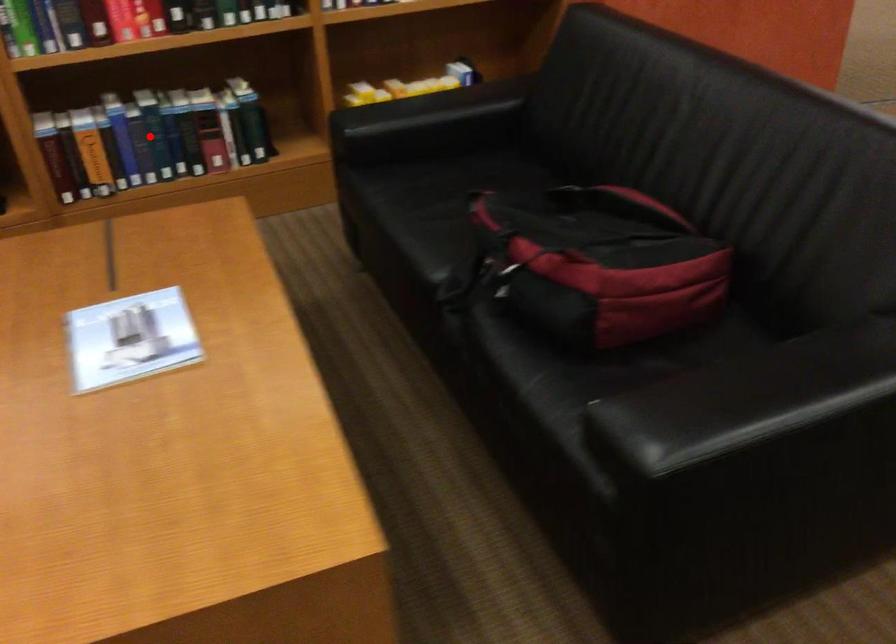
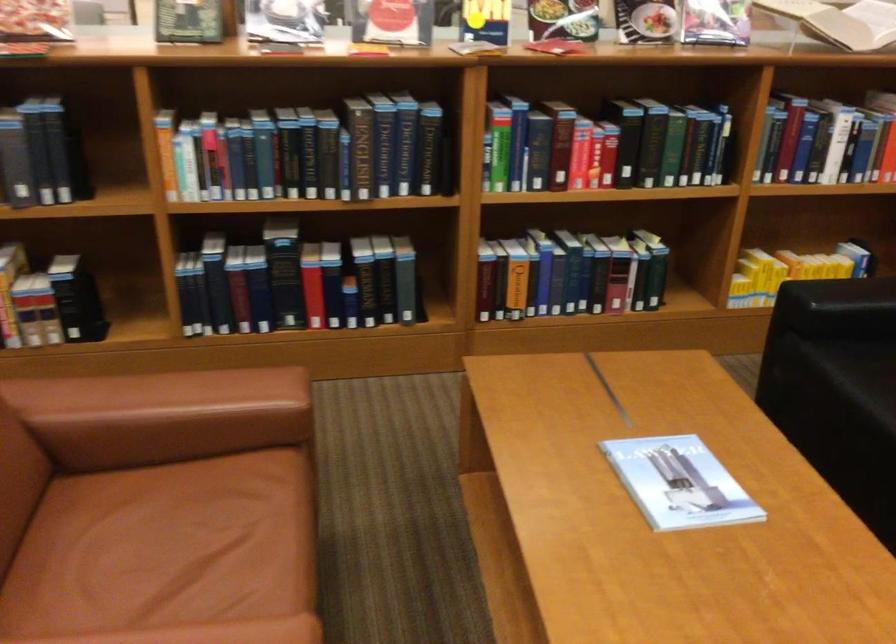
The point at the highlighted location is marked in the first image. Where is the corresponding point in the second image?

(569, 275)